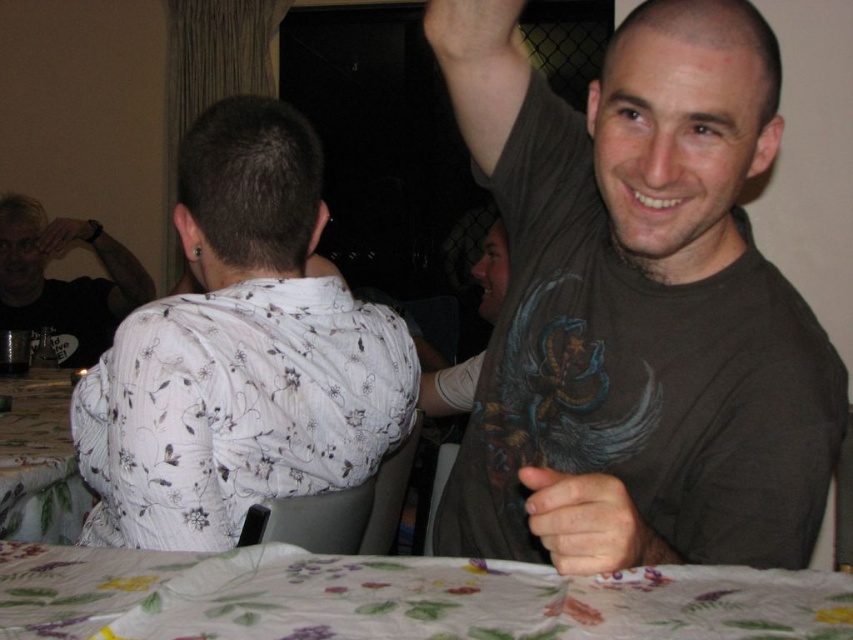
In the scene shown: What is the relationship between the size of the matte skin at upper center and the matte black ring at upper left?

The matte skin at upper center has a smaller size compared to the matte black ring at upper left.

You are at a party and want to place a small gift on the table. The gift requires a flat surface that is lower than the matte gray shirt at upper center. Can you place it on the floral printed fabric at lower center?

The floral printed fabric at lower center has a lesser height compared to the matte gray shirt at upper center, so yes, the gift can be placed on the floral printed fabric at lower center as it is lower than the required height.